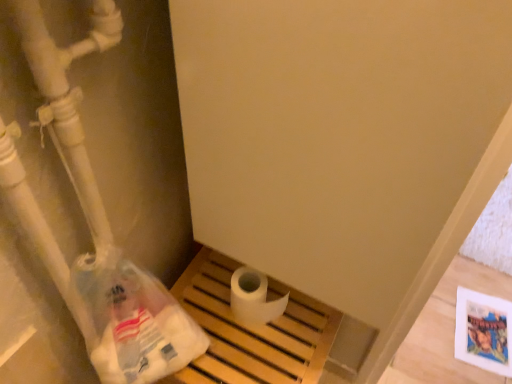
Question: Based on their sizes in the image, would you say white matte toilet paper at center is bigger or smaller than translucent plastic bag at lower left?

Choices:
 (A) small
 (B) big

Answer: (A)

Question: Considering the positions of white matte toilet paper at center and translucent plastic bag at lower left in the image, is white matte toilet paper at center taller or shorter than translucent plastic bag at lower left?

Choices:
 (A) tall
 (B) short

Answer: (B)

Question: From a real-world perspective, relative to translucent plastic bag at lower left, is white matte toilet paper at center vertically above or below?

Choices:
 (A) below
 (B) above

Answer: (A)

Question: From their relative heights in the image, would you say translucent plastic bag at lower left is taller or shorter than white matte toilet paper at center?

Choices:
 (A) short
 (B) tall

Answer: (B)

Question: Relative to white matte toilet paper at center, is translucent plastic bag at lower left in front or behind?

Choices:
 (A) behind
 (B) front

Answer: (B)

Question: From the image's perspective, is translucent plastic bag at lower left above or below white matte toilet paper at center?

Choices:
 (A) above
 (B) below

Answer: (B)

Question: Is translucent plastic bag at lower left situated inside white matte toilet paper at center or outside?

Choices:
 (A) outside
 (B) inside

Answer: (A)